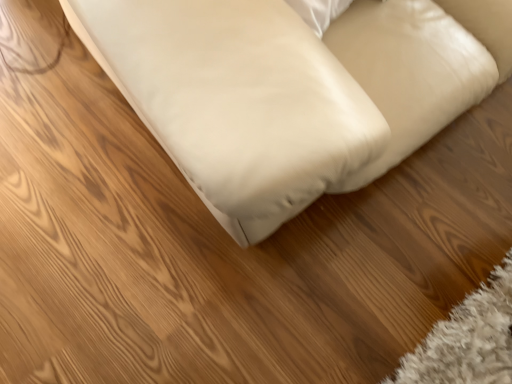
What are the coordinates of `leather-like beige sofa at center` in the screenshot? It's located at (292, 90).

In order to face leather-like beige sofa at center, should I rotate leftwards or rightwards?

To align with it, rotate right about 19.453°.

Image resolution: width=512 pixels, height=384 pixels. What do you see at coordinates (292, 90) in the screenshot? I see `leather-like beige sofa at center` at bounding box center [292, 90].

The width and height of the screenshot is (512, 384). I want to click on leather-like beige sofa at center, so click(292, 90).